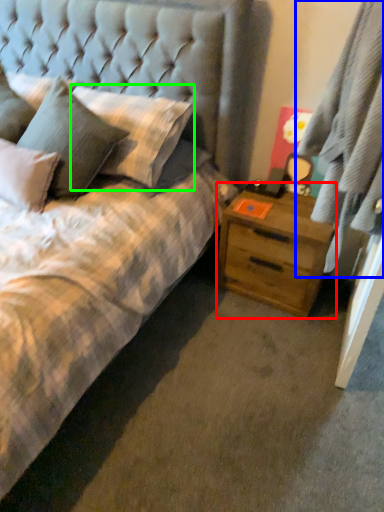
Question: Considering the real-world distances, which object is closest to nightstand (highlighted by a red box)? curtain (highlighted by a blue box) or pillow (highlighted by a green box).

Choices:
 (A) curtain
 (B) pillow

Answer: (A)